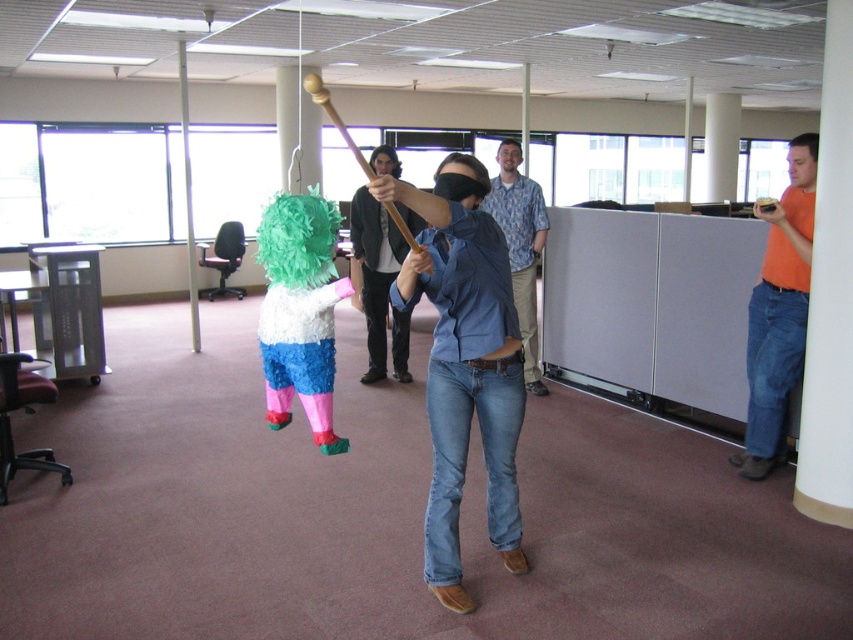
Is point (361, 260) positioned in front of point (509, 200)?

No.

Identify the location of blue jeans at center. The height and width of the screenshot is (640, 853). (374, 272).

Is point (355, 198) positioned after point (485, 211)?

That is True.

Where is `blue jeans at center`? Image resolution: width=853 pixels, height=640 pixels. blue jeans at center is located at coordinates (374, 272).

Which of these two, denim jeans at center or blue jeans at center, stands shorter?

Standing shorter between the two is denim jeans at center.

What do you see at coordinates (463, 362) in the screenshot? I see `denim jeans at center` at bounding box center [463, 362].

This screenshot has height=640, width=853. Find the location of `denim jeans at center`. denim jeans at center is located at coordinates (463, 362).

Can you confirm if orange cotton shirt at right is taller than blue denim jeans at center?

Yes, orange cotton shirt at right is taller than blue denim jeans at center.

From the picture: Is orange cotton shirt at right to the right of blue denim jeans at center from the viewer's perspective?

Correct, you'll find orange cotton shirt at right to the right of blue denim jeans at center.

Where is `orange cotton shirt at right`? orange cotton shirt at right is located at coordinates (778, 310).